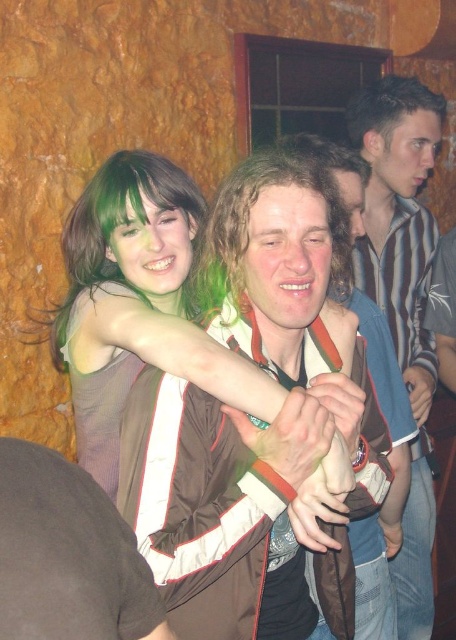
You are at a party and want to locate the person with matte green hair at center. Based on the coordinates provided, where should you look in the image?

The matte green hair at center is located at coordinates point (x=138, y=305).

Consider the image. You are at a party and want to take a photo of both the green hair at upper left and the matte brown hair at center. However, you notice that one of them is blocking the other. Which person should you ask to move slightly so that both are fully visible in the photo?

The green hair at upper left is in front of matte brown hair at center, so you should ask the person with green hair at upper left to move slightly backward or to the side to allow the matte brown hair at center to be fully visible.

You are at a party and want to take a photo of both the matte green hair at center and the matte brown jacket at center. However, you notice that one is blocking the other. Which object is blocking the other?

The matte green hair at center is blocking the matte brown jacket at center because it is positioned in front of it.